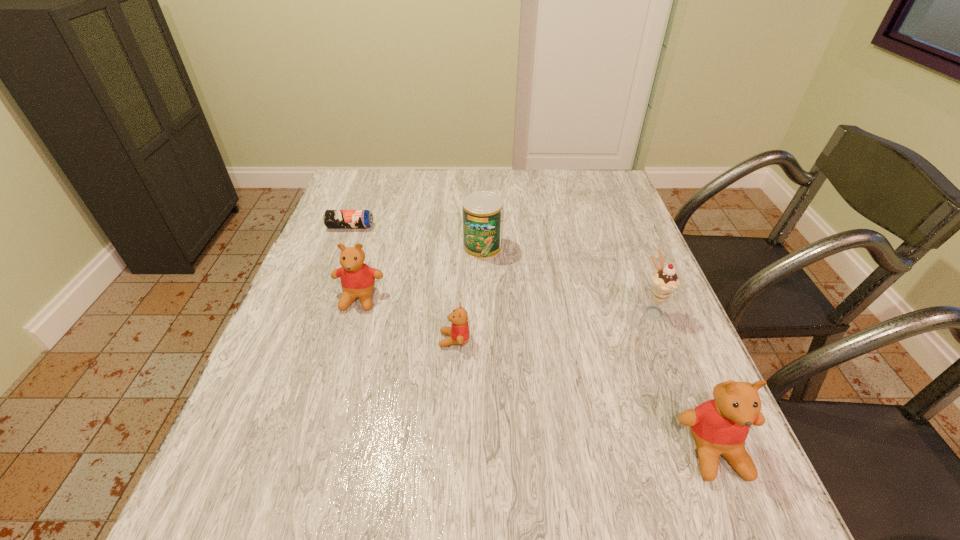
The height and width of the screenshot is (540, 960). What are the coordinates of `vacant spot for a new teddy_bear to ensure equal spacing` in the screenshot? It's located at (570, 390).